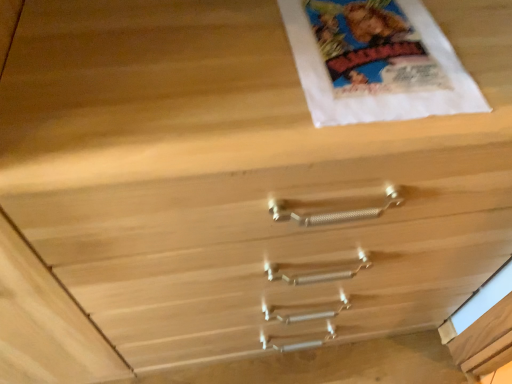
Locate an element on the screen. This screenshot has height=384, width=512. vacant area on top of white paper comic book at upper center (from a real-world perspective) is located at coordinates [372, 45].